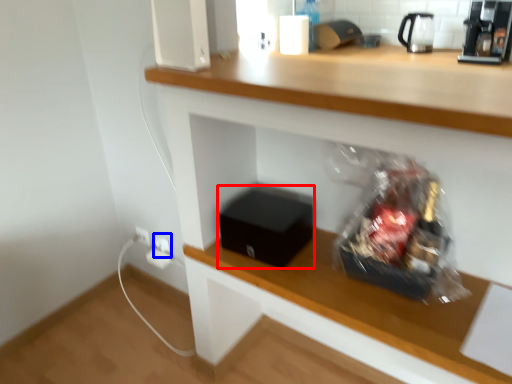
Question: Which object appears closest to the camera in this image, box (highlighted by a red box) or electric outlet (highlighted by a blue box)?

Choices:
 (A) box
 (B) electric outlet

Answer: (A)